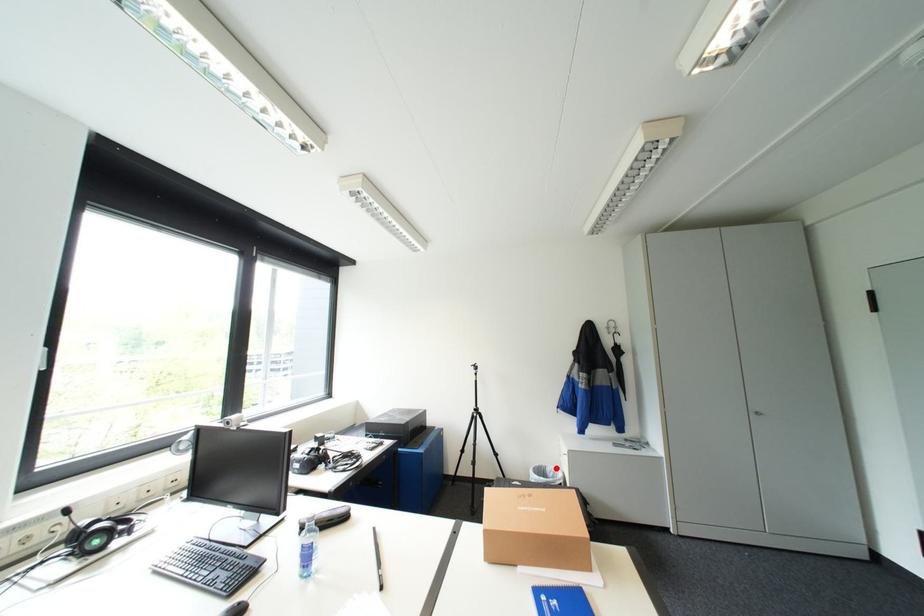
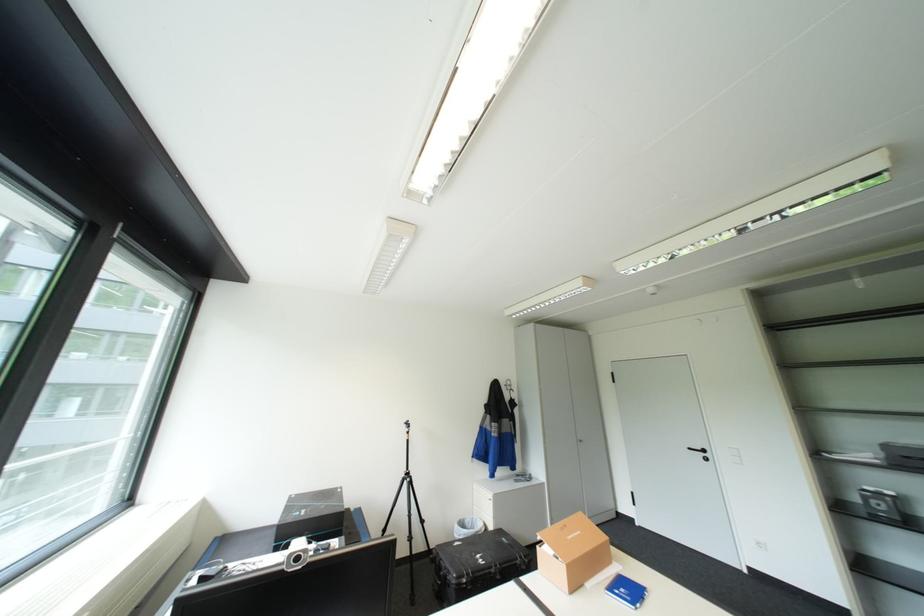
Question: I am providing you with two images of the same scene from different viewpoints. Given a red point in image1, look at the same physical point in image2. Is it:

Choices:
 (A) Closer to the viewpoint
 (B) Farther from the viewpoint

Answer: (B)